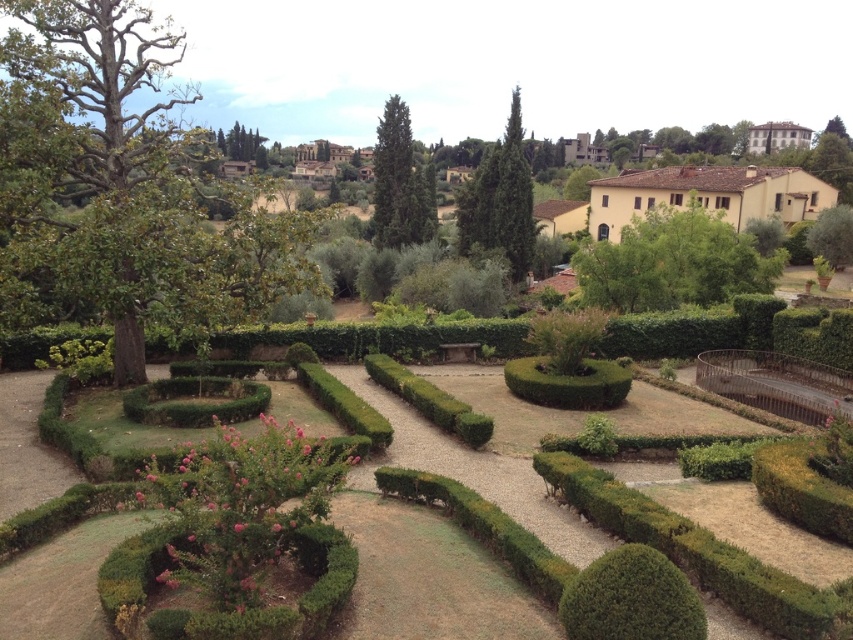
Who is positioned more to the left, green textured tree at upper center or green textured tree at center?

From the viewer's perspective, green textured tree at center appears more on the left side.

Is the position of green textured tree at upper center less distant than that of green textured tree at center?

Yes, it is in front of green textured tree at center.

Is point (503, 225) positioned in front of point (416, 200)?

That is True.

Identify the location of green textured tree at upper center. The image size is (853, 640). (500, 200).

Find the location of a particular element. green leafy tree at left is located at coordinates (125, 188).

Is point (128, 310) positioned behind point (846, 205)?

No, it is not.

I want to click on green leafy tree at left, so click(125, 188).

Is green textured tree at center to the left of green leafy tree at upper center from the viewer's perspective?

Yes, green textured tree at center is to the left of green leafy tree at upper center.

Does point (395, 179) lie in front of point (616, 140)?

Yes, point (395, 179) is in front of point (616, 140).

Where is `green textured tree at center`? green textured tree at center is located at coordinates (399, 182).